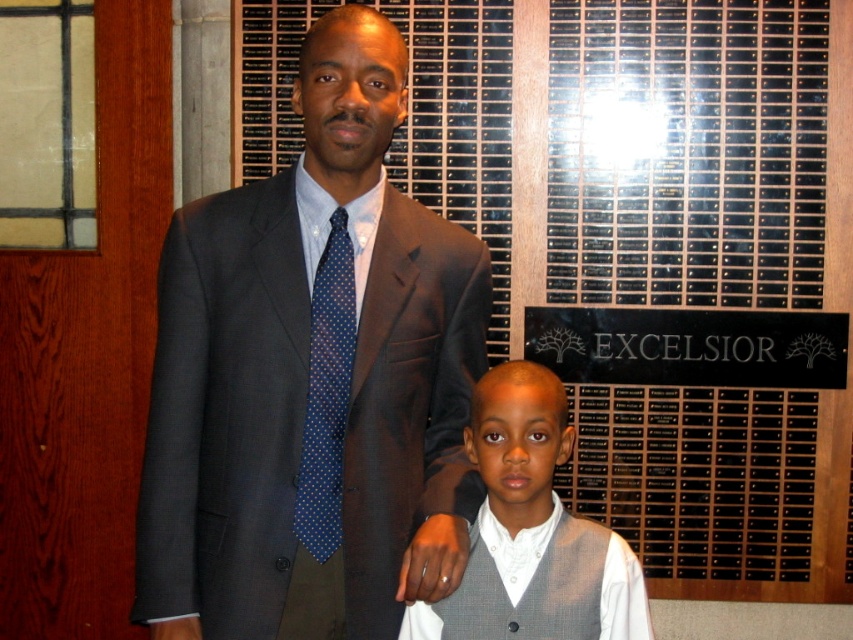
Which is more to the right, matte gray suit at center or blue dotted tie at center?

matte gray suit at center is more to the right.

At what (x,y) coordinates should I click in order to perform the action: click on matte gray suit at center. Please return your answer as a coordinate pair (x, y). Looking at the image, I should click on (312, 380).

Is the position of gray textured vest at center less distant than that of blue dotted tie at center?

No, gray textured vest at center is behind blue dotted tie at center.

Does gray textured vest at center have a smaller size compared to blue dotted tie at center?

No.

Locate an element on the screen. gray textured vest at center is located at coordinates (532, 532).

Find the location of a particular element. The image size is (853, 640). gray textured vest at center is located at coordinates (532, 532).

Which is more to the right, matte gray suit at center or gray textured vest at center?

From the viewer's perspective, gray textured vest at center appears more on the right side.

Does point (268, 582) lie in front of point (544, 632)?

Yes.

What do you see at coordinates (312, 380) in the screenshot? I see `matte gray suit at center` at bounding box center [312, 380].

The height and width of the screenshot is (640, 853). What are the coordinates of `matte gray suit at center` in the screenshot? It's located at (312, 380).